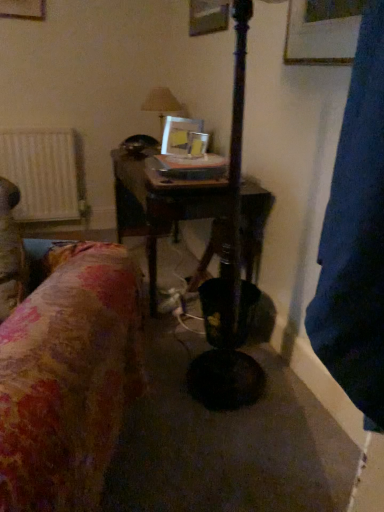
Question: Is the position of metallic silver picture frame at center less distant than that of wooden table at center?

Choices:
 (A) no
 (B) yes

Answer: (A)

Question: Is metallic silver picture frame at center at the right side of wooden table at center?

Choices:
 (A) yes
 (B) no

Answer: (A)

Question: From a real-world perspective, is metallic silver picture frame at center located beneath wooden table at center?

Choices:
 (A) no
 (B) yes

Answer: (A)

Question: Is metallic silver picture frame at center with wooden table at center?

Choices:
 (A) yes
 (B) no

Answer: (B)

Question: Considering the relative sizes of metallic silver picture frame at center and wooden table at center in the image provided, is metallic silver picture frame at center taller than wooden table at center?

Choices:
 (A) yes
 (B) no

Answer: (B)

Question: Considering the relative sizes of metallic silver picture frame at center and wooden table at center in the image provided, is metallic silver picture frame at center shorter than wooden table at center?

Choices:
 (A) yes
 (B) no

Answer: (A)

Question: Considering the relative sizes of matte white lampshade at center and metallic silver picture frame at center in the image provided, is matte white lampshade at center bigger than metallic silver picture frame at center?

Choices:
 (A) yes
 (B) no

Answer: (A)

Question: Can we say matte white lampshade at center lies outside metallic silver picture frame at center?

Choices:
 (A) yes
 (B) no

Answer: (A)

Question: Is matte white lampshade at center next to metallic silver picture frame at center?

Choices:
 (A) yes
 (B) no

Answer: (B)

Question: Can you confirm if matte white lampshade at center is positioned to the left of metallic silver picture frame at center?

Choices:
 (A) yes
 (B) no

Answer: (A)

Question: Considering the relative sizes of matte white lampshade at center and metallic silver picture frame at center in the image provided, is matte white lampshade at center smaller than metallic silver picture frame at center?

Choices:
 (A) no
 (B) yes

Answer: (A)

Question: Is matte white lampshade at center positioned before metallic silver picture frame at center?

Choices:
 (A) yes
 (B) no

Answer: (B)

Question: Considering the relative positions of wooden table at center and metallic silver picture frame at center in the image provided, is wooden table at center behind metallic silver picture frame at center?

Choices:
 (A) yes
 (B) no

Answer: (B)